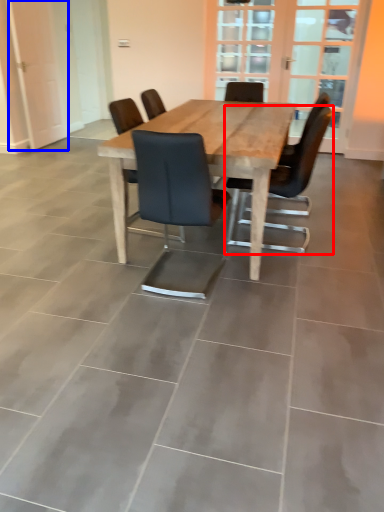
Question: Which point is closer to the camera, chair (highlighted by a red box) or screen door (highlighted by a blue box)?

Choices:
 (A) chair
 (B) screen door

Answer: (A)